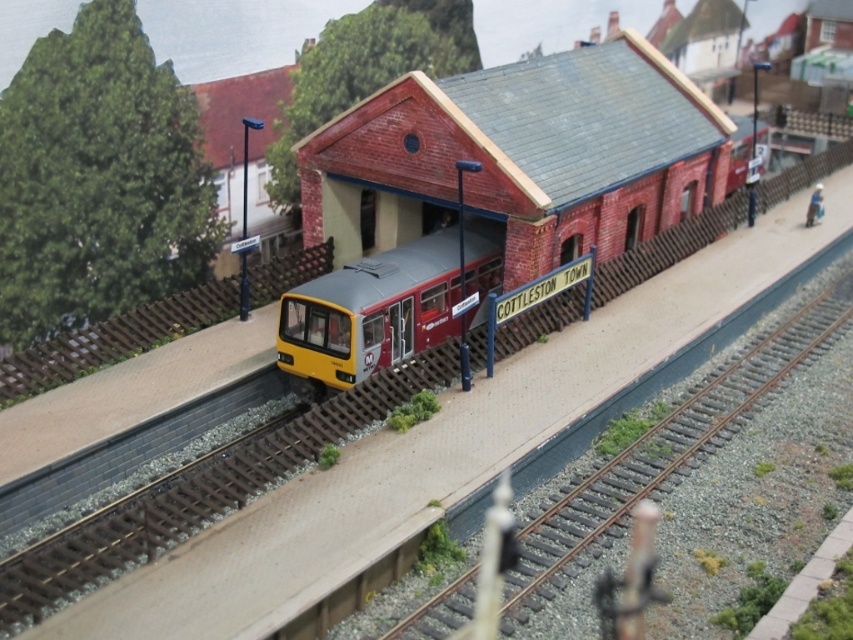
You are a model train enthusiast who wants to place a new train on the track. Based on the scene, can you determine if the yellow matte passenger train at center is currently on the metallic brown train track at center?

The metallic brown train track at center is below the yellow matte passenger train at center, so yes, the yellow matte passenger train at center is currently on the metallic brown train track at center.

Consider the image. You are a model train enthusiast who wants to place a new locomotive that is 2 meters long on the track. Given the current setup, can the locomotive fit between the metallic brown train track at center and the yellow matte passenger train at center without any adjustments?

The distance between the metallic brown train track at center and the yellow matte passenger train at center is 4.33 meters. Since the locomotive is 2 meters long, there is sufficient space between them for the locomotive to fit without adjustments.

You are a model train enthusiast who wants to place a new train car at the point indicated by the coordinates. What object is located at the point (666, 451) in the image?

The point (666, 451) indicates the location of the metallic brown train track at center.